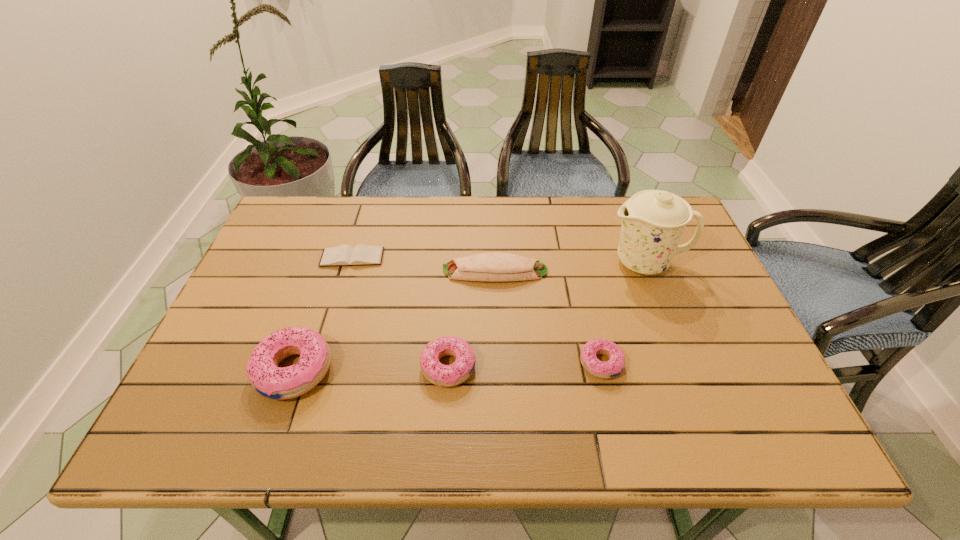
What are the coordinates of `the leftmost doughnut` in the screenshot? It's located at (279, 383).

The width and height of the screenshot is (960, 540). Find the location of `the second tallest object`. the second tallest object is located at coordinates (279, 383).

Where is `the second doughnut from right to left`? This screenshot has height=540, width=960. the second doughnut from right to left is located at coordinates (435, 372).

You are a GUI agent. You are given a task and a screenshot of the screen. Output one action in this format:
    pyautogui.click(x=<x>, y=<y>)
    Task: Click on the second shortest doughnut
    This screenshot has height=540, width=960.
    Given the screenshot: What is the action you would take?
    pyautogui.click(x=435, y=372)

Where is `the shortest doughnut`? The height and width of the screenshot is (540, 960). the shortest doughnut is located at coordinates (614, 366).

Image resolution: width=960 pixels, height=540 pixels. What are the coordinates of `the second object from right to left` in the screenshot? It's located at (614, 366).

The height and width of the screenshot is (540, 960). What are the coordinates of `burrito` in the screenshot? It's located at (494, 266).

Identify the location of diary. (344, 255).

Where is `chinaware`? chinaware is located at coordinates (653, 223).

Where is `the tallest object`? This screenshot has width=960, height=540. the tallest object is located at coordinates (653, 223).